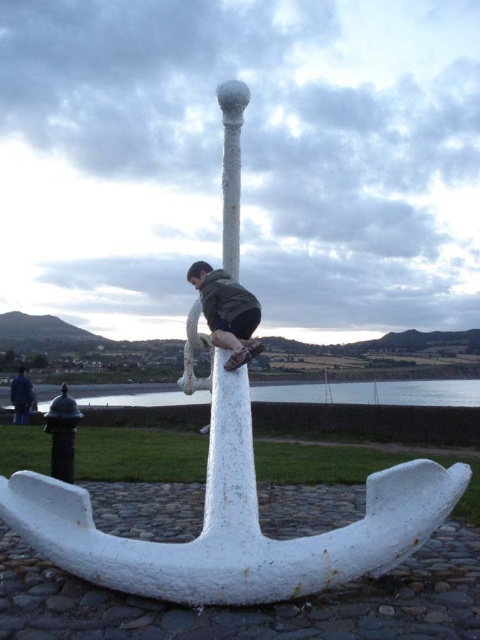
Question: Does dark gray fabric jacket at center lie behind blue fabric jacket at lower left?

Choices:
 (A) yes
 (B) no

Answer: (B)

Question: Is clear water at anchor center further to camera compared to dark gray fabric jacket at center?

Choices:
 (A) no
 (B) yes

Answer: (B)

Question: Can you confirm if clear water at anchor center is thinner than blue fabric jacket at lower left?

Choices:
 (A) no
 (B) yes

Answer: (A)

Question: Estimate the real-world distances between objects in this image. Which object is closer to the dark gray fabric jacket at center?

Choices:
 (A) blue fabric jacket at lower left
 (B) clear water at anchor center

Answer: (B)

Question: Which point is farther to the camera?

Choices:
 (A) (20, 410)
 (B) (269, 394)

Answer: (B)

Question: Estimate the real-world distances between objects in this image. Which object is closer to the blue fabric jacket at lower left?

Choices:
 (A) clear water at anchor center
 (B) dark gray fabric jacket at center

Answer: (A)